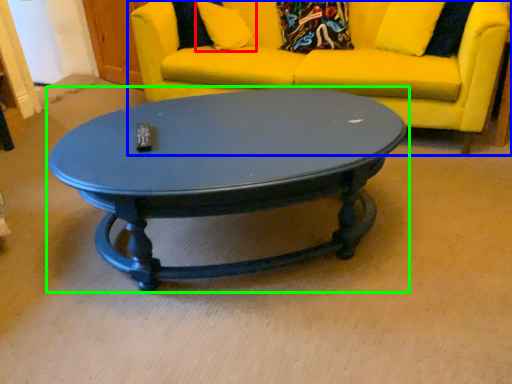
Question: Estimate the real-world distances between objects in this image. Which object is closer to pillow (highlighted by a red box), studio couch (highlighted by a blue box) or coffee table (highlighted by a green box)?

Choices:
 (A) studio couch
 (B) coffee table

Answer: (A)